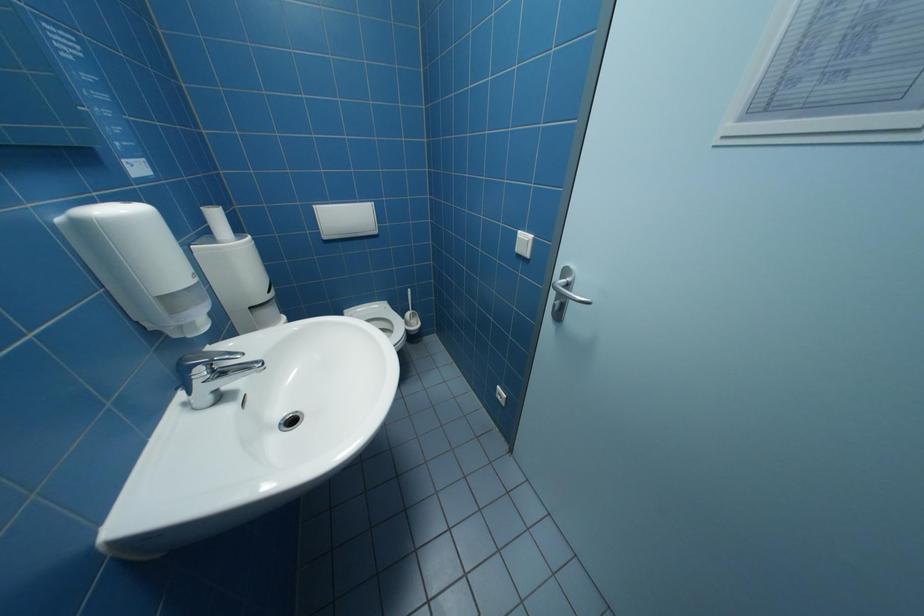
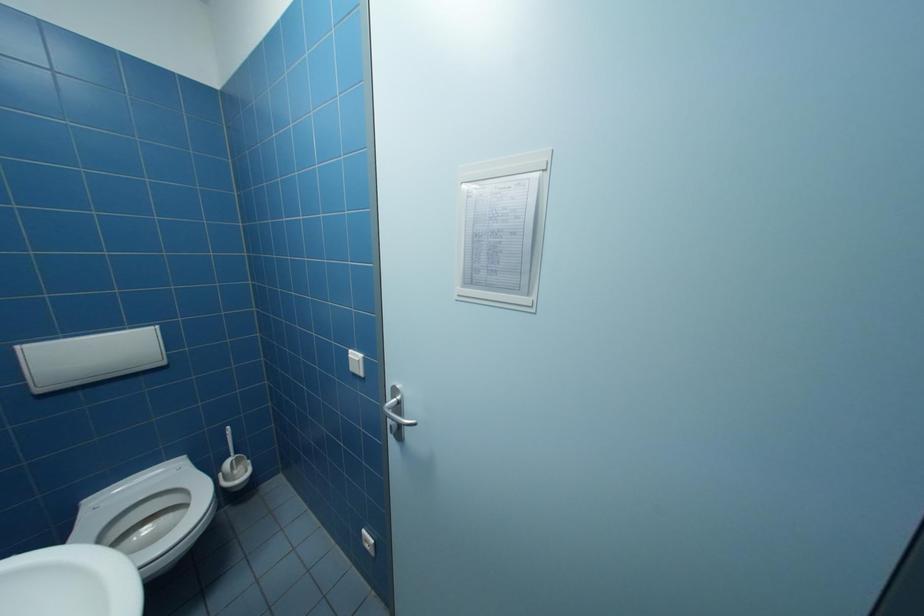
Question: The first image is from the beginning of the video and the second image is from the end. How did the camera likely rotate when shooting the video?

Choices:
 (A) Left
 (B) Right
 (C) Up
 (D) Down

Answer: (B)